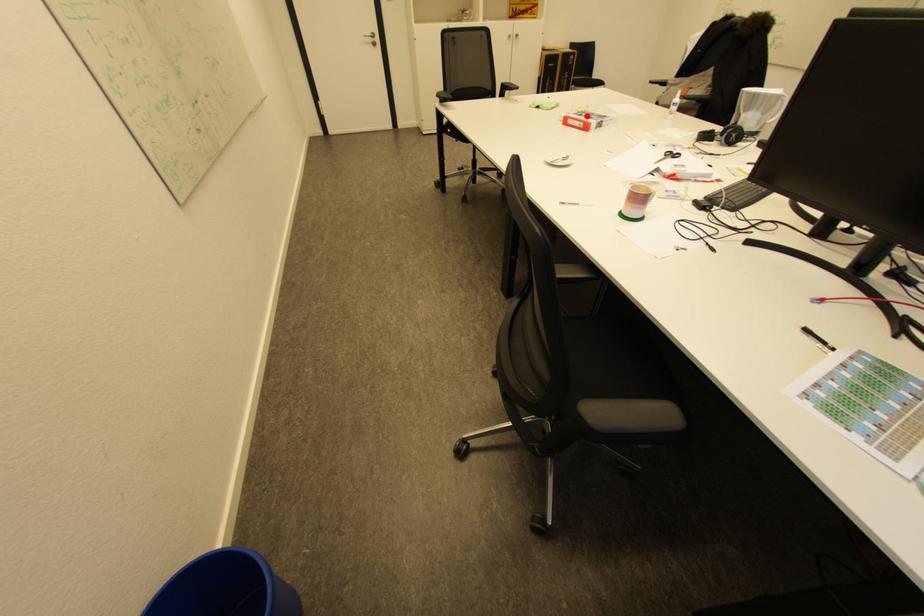
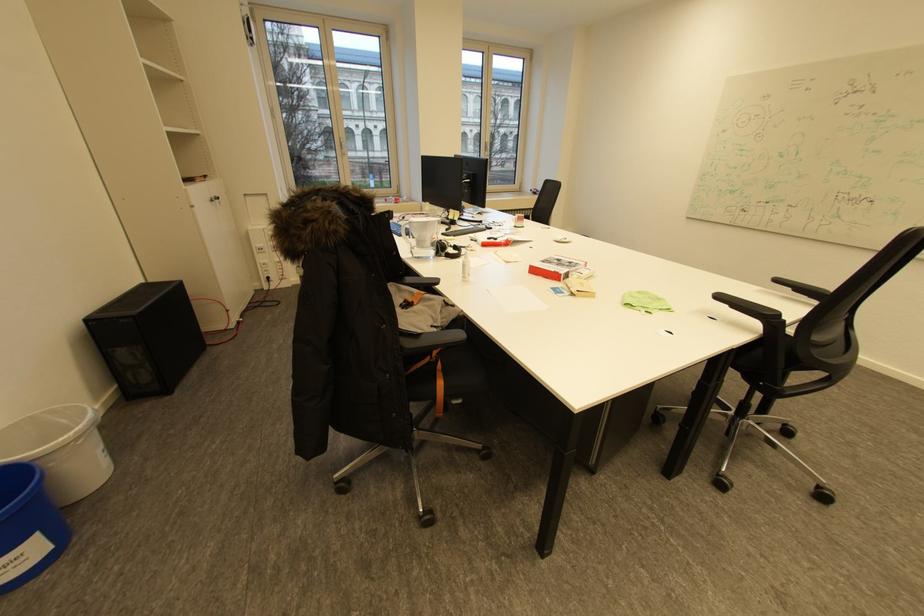
In the second image, find the point that corresponds to the highlighted location in the first image.

(576, 262)